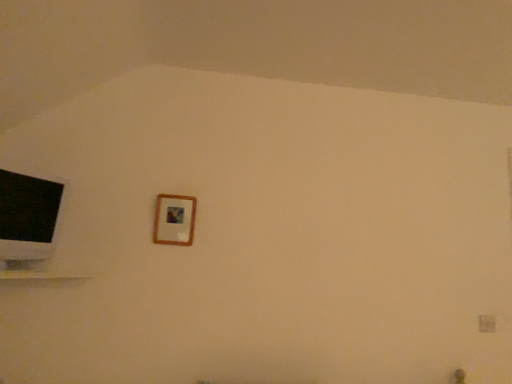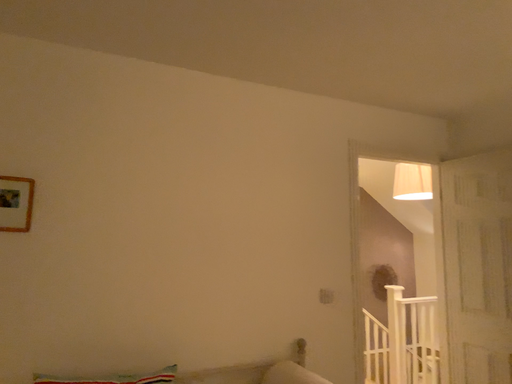
Question: How did the camera likely rotate when shooting the video?

Choices:
 (A) rotated right
 (B) rotated left

Answer: (A)